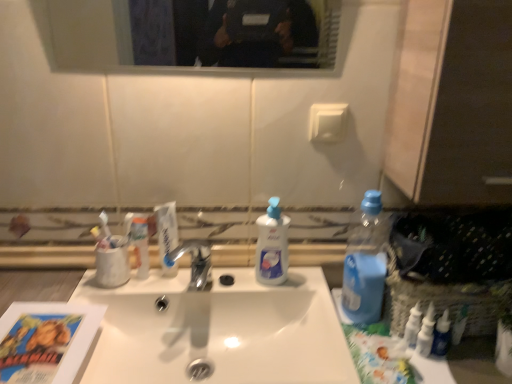
Identify the location of vacant space in front of translucent plastic tube at center, which is counted as the 3th toiletry, starting from the right. (104, 309).